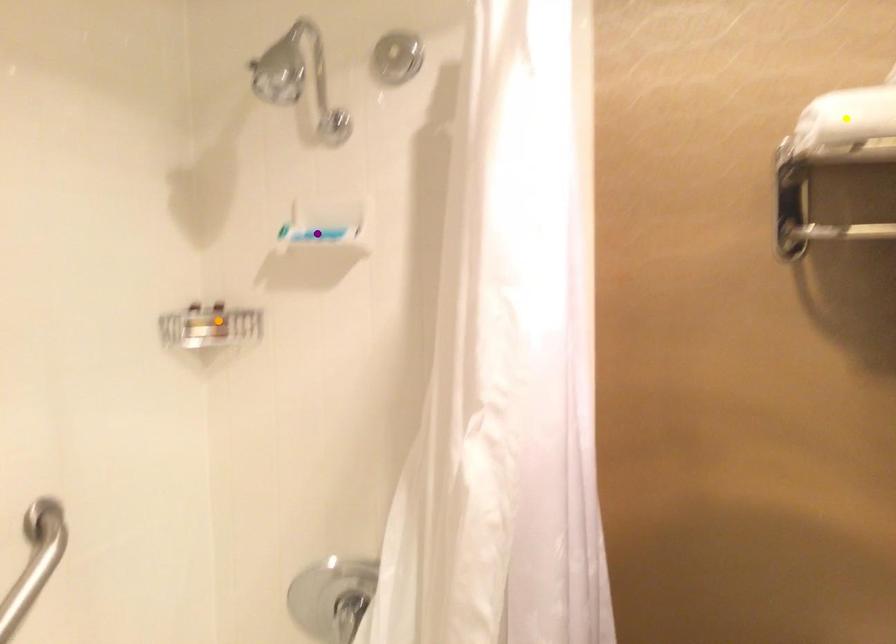
Order these from farthest to nearest:
1. yellow point
2. purple point
3. orange point

orange point < purple point < yellow point